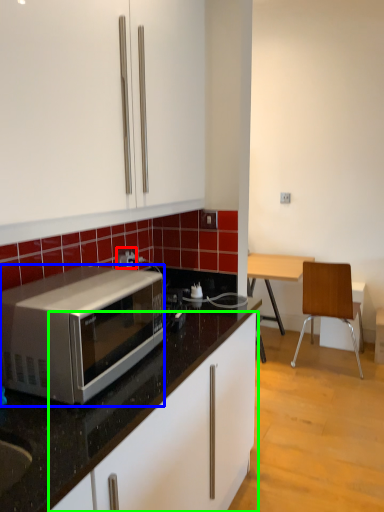
Question: Considering the real-world distances, which object is farthest from power outlet (highlighted by a red box)? microwave oven (highlighted by a blue box) or cabinetry (highlighted by a green box)?

Choices:
 (A) microwave oven
 (B) cabinetry

Answer: (B)